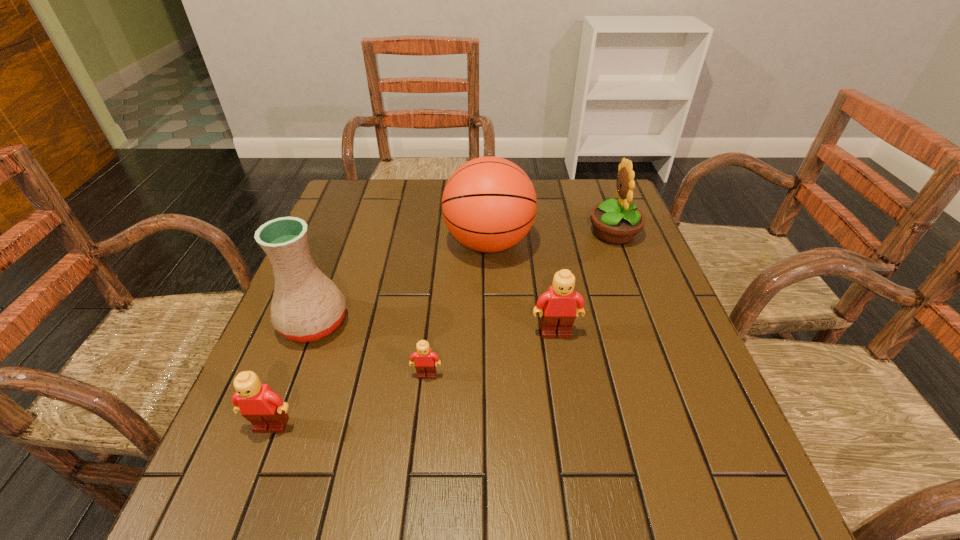
Please show where to add a Lego on the right while keeping spacing even. Please provide its 2D coordinates. Your answer should be formatted as a tuple, i.e. [(x, y)], where the tuple contains the x and y coordinates of a point satisfying the conditions above.

[(664, 297)]